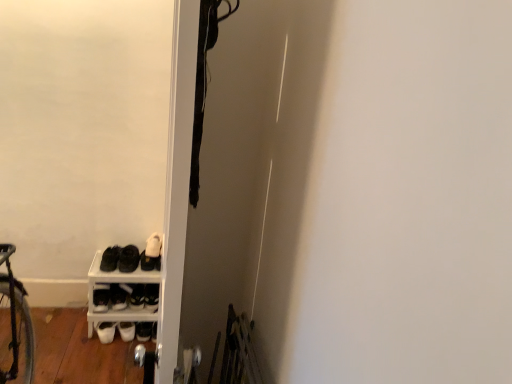
Question: From the image's perspective, does white matte sneakers at lower left, the first footwear viewed from the left, appear lower than white matte shoe at lower left, the third footwear viewed from the left?

Choices:
 (A) yes
 (B) no

Answer: (A)

Question: From a real-world perspective, is white matte sneakers at lower left, positioned as the fourth footwear in right-to-left order, located beneath white matte shoe at lower left, the third footwear viewed from the left?

Choices:
 (A) no
 (B) yes

Answer: (B)

Question: Is white matte sneakers at lower left, positioned as the fourth footwear in right-to-left order, not inside white matte shoe at lower left, the third footwear viewed from the left?

Choices:
 (A) no
 (B) yes

Answer: (B)

Question: Is the depth of white matte sneakers at lower left, positioned as the fourth footwear in right-to-left order, less than that of white matte shoe at lower left, the third footwear viewed from the left?

Choices:
 (A) no
 (B) yes

Answer: (B)

Question: Can you confirm if white matte sneakers at lower left, the first footwear viewed from the left, is wider than white matte shoe at lower left, which ranks as the second footwear in right-to-left order?

Choices:
 (A) yes
 (B) no

Answer: (B)

Question: Is black matte shoes at lower left, which is the second footwear from left to right, bigger or smaller than white matte shoe rack at lower left?

Choices:
 (A) big
 (B) small

Answer: (B)

Question: In the image, is black matte shoes at lower left, which appears as the third footwear when viewed from the right, positioned in front of or behind white matte shoe rack at lower left?

Choices:
 (A) behind
 (B) front

Answer: (A)

Question: From a real-world perspective, is black matte shoes at lower left, which appears as the third footwear when viewed from the right, physically located above or below white matte shoe rack at lower left?

Choices:
 (A) below
 (B) above

Answer: (B)

Question: Is point (121, 268) positioned closer to the camera than point (158, 276)?

Choices:
 (A) closer
 (B) farther

Answer: (B)

Question: From a real-world perspective, relative to white leather shoe at lower left, the fourth footwear positioned from the left, is black matte shoes at lower left, which is the second footwear from left to right, vertically above or below?

Choices:
 (A) below
 (B) above

Answer: (B)

Question: Relative to white leather shoe at lower left, marked as the first footwear in a right-to-left arrangement, is black matte shoes at lower left, which is the second footwear from left to right, in front or behind?

Choices:
 (A) behind
 (B) front

Answer: (B)

Question: Does point pyautogui.click(x=128, y=244) appear closer or farther from the camera than point pyautogui.click(x=155, y=306)?

Choices:
 (A) closer
 (B) farther

Answer: (B)

Question: From the image's perspective, is black matte shoes at lower left, which is the second footwear from left to right, positioned above or below white leather shoe at lower left, the fourth footwear positioned from the left?

Choices:
 (A) above
 (B) below

Answer: (A)

Question: Is white matte shoe rack at lower left inside the boundaries of white leather shoe at lower left, marked as the first footwear in a right-to-left arrangement, or outside?

Choices:
 (A) inside
 (B) outside

Answer: (B)

Question: From the image's perspective, relative to white leather shoe at lower left, the fourth footwear positioned from the left, is white matte shoe rack at lower left above or below?

Choices:
 (A) below
 (B) above

Answer: (B)